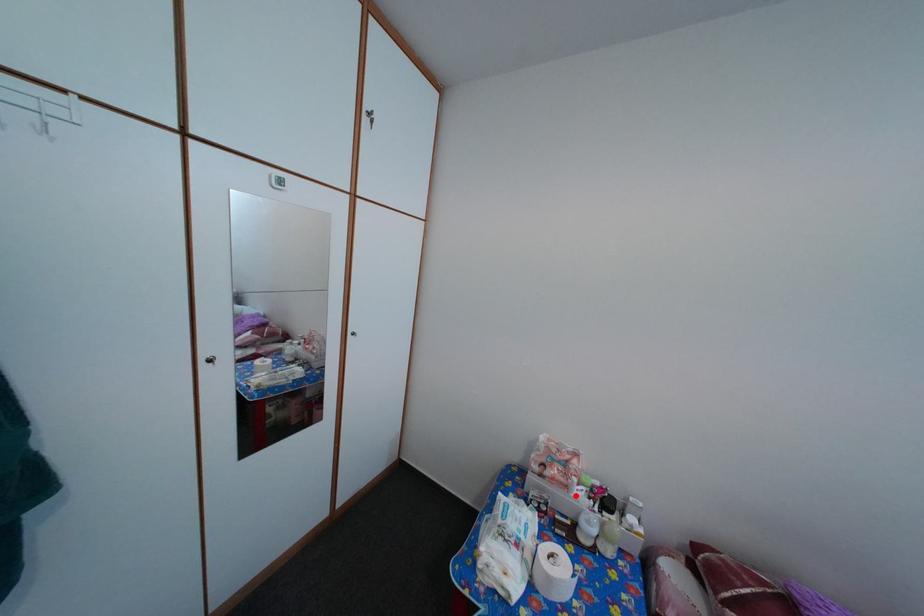
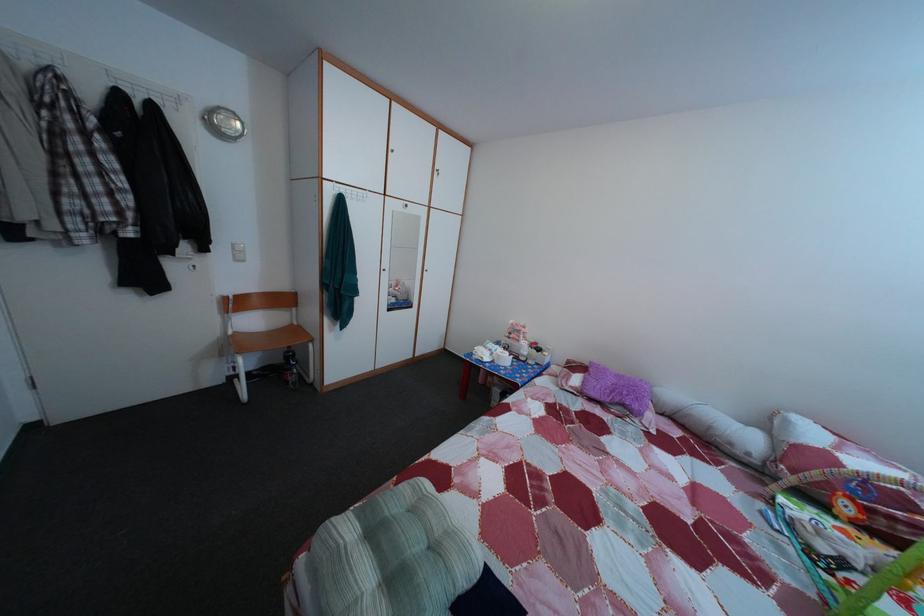
Find the pixel in the second image that matches the highlighted location in the first image.

(528, 349)